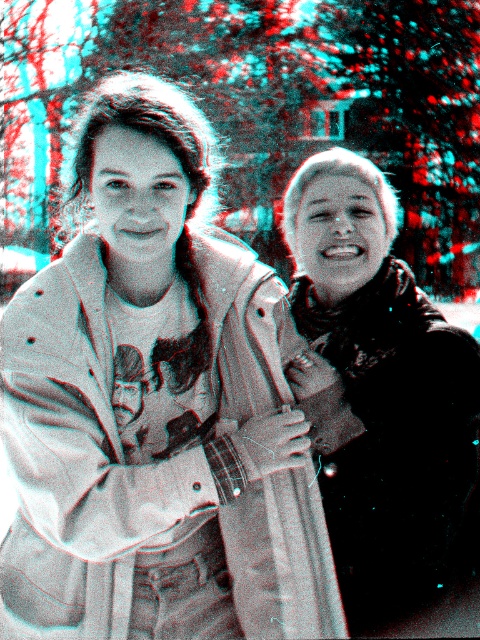
Consider the image. You are planning to take a photo of the light beige textured trench coat at center and the velvet black scarf at right. Which object should you focus on first if you want to capture both in a single frame without moving the camera? Explain your reasoning based on their positions.

The light beige textured trench coat at center is to the left of the velvet black scarf at right. Therefore, focusing on the light beige textured trench coat at center first would allow you to position it on the left side of the frame, making space for the velvet black scarf at right on the right side, ensuring both are included without camera movement.

You are a fashion designer who needs to create a matching accessory for both the light beige textured trench coat at center and the velvet black scarf at right. Considering their sizes, which item would require a larger accessory to maintain proportion?

The light beige textured trench coat at center requires a larger accessory since it is larger in size than the velvet black scarf at right.